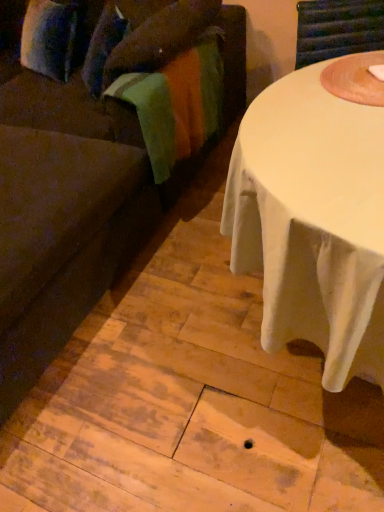
Question: From the image's perspective, relative to velvety green blanket at left, is brown fabric couch at left above or below?

Choices:
 (A) above
 (B) below

Answer: (B)

Question: In the image, is brown fabric couch at left on the left side or the right side of velvety green blanket at left?

Choices:
 (A) left
 (B) right

Answer: (A)

Question: From a real-world perspective, is brown fabric couch at left positioned above or below velvety green blanket at left?

Choices:
 (A) above
 (B) below

Answer: (A)

Question: Looking at the image, does velvety green blanket at left seem bigger or smaller compared to brown fabric couch at left?

Choices:
 (A) small
 (B) big

Answer: (A)

Question: From the image's perspective, is velvety green blanket at left above or below brown fabric couch at left?

Choices:
 (A) below
 (B) above

Answer: (B)

Question: In terms of height, does velvety green blanket at left look taller or shorter compared to brown fabric couch at left?

Choices:
 (A) tall
 (B) short

Answer: (B)

Question: Is velvety green blanket at left situated inside brown fabric couch at left or outside?

Choices:
 (A) outside
 (B) inside

Answer: (B)